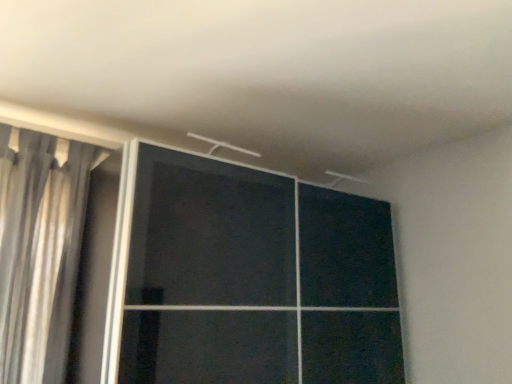
Question: Is transparent glass door at center thinner than silky gray curtain at left?

Choices:
 (A) yes
 (B) no

Answer: (B)

Question: Is transparent glass door at center not within silky gray curtain at left?

Choices:
 (A) no
 (B) yes

Answer: (B)

Question: Does transparent glass door at center appear on the right side of silky gray curtain at left?

Choices:
 (A) no
 (B) yes

Answer: (B)

Question: Is transparent glass door at center facing away from silky gray curtain at left?

Choices:
 (A) yes
 (B) no

Answer: (B)

Question: Is transparent glass door at center far away from silky gray curtain at left?

Choices:
 (A) yes
 (B) no

Answer: (B)

Question: From a real-world perspective, is transparent glass door at center on silky gray curtain at left?

Choices:
 (A) no
 (B) yes

Answer: (A)

Question: Does silky gray curtain at left have a lesser height compared to transparent glass door at center?

Choices:
 (A) no
 (B) yes

Answer: (B)

Question: Is silky gray curtain at left facing towards transparent glass door at center?

Choices:
 (A) yes
 (B) no

Answer: (B)

Question: Can you confirm if silky gray curtain at left is positioned to the right of transparent glass door at center?

Choices:
 (A) yes
 (B) no

Answer: (B)

Question: From the image's perspective, would you say silky gray curtain at left is shown under transparent glass door at center?

Choices:
 (A) no
 (B) yes

Answer: (A)

Question: Does silky gray curtain at left have a larger size compared to transparent glass door at center?

Choices:
 (A) no
 (B) yes

Answer: (A)

Question: Is silky gray curtain at left thinner than transparent glass door at center?

Choices:
 (A) no
 (B) yes

Answer: (B)

Question: Is silky gray curtain at left wider or thinner than transparent glass door at center?

Choices:
 (A) wide
 (B) thin

Answer: (B)